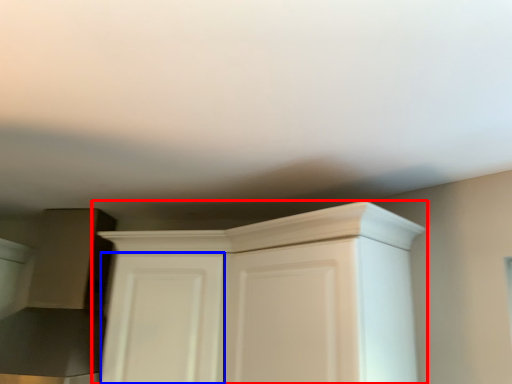
Question: Which object is closer to the camera taking this photo, cupboard (highlighted by a red box) or door (highlighted by a blue box)?

Choices:
 (A) cupboard
 (B) door

Answer: (A)